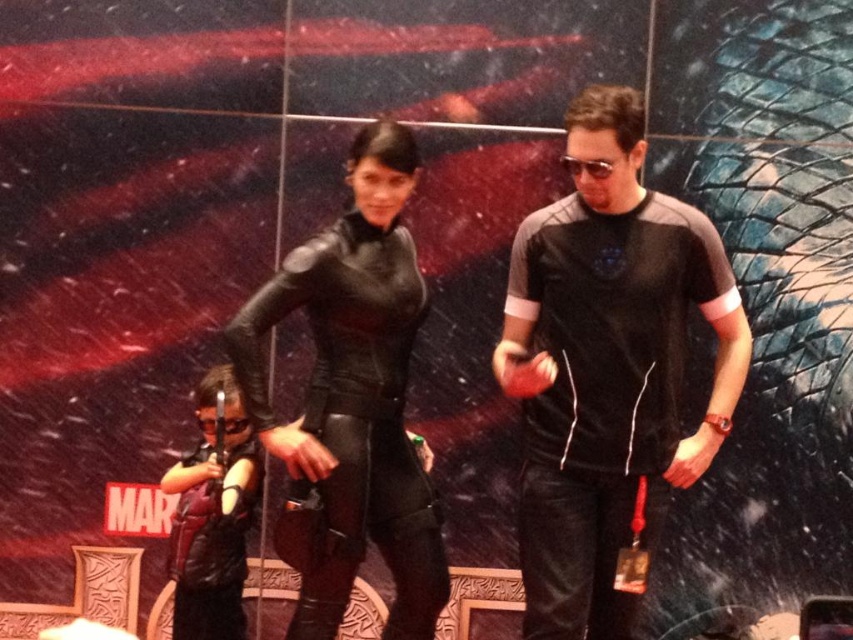
Where is `black fabric shirt at center`? black fabric shirt at center is located at coordinates click(x=607, y=364).

Which is behind, point (544, 577) or point (213, 604)?

The point (213, 604) is more distant.

The image size is (853, 640). In order to click on black fabric shirt at center in this screenshot , I will do `click(607, 364)`.

Is point (595, 470) in front of point (247, 401)?

No, it is behind (247, 401).

Which is behind, point (630, 429) or point (410, 627)?

The point (410, 627) is more distant.

Measure the distance between point (531, 320) and camera.

A distance of 2.66 meters exists between point (531, 320) and camera.

This screenshot has width=853, height=640. Identify the location of black fabric shirt at center. (607, 364).

Consider the image. How far apart are black leather suit at center and black leather wetsuit at center?

They are 26.32 inches apart.

Is black leather suit at center taller than black leather wetsuit at center?

Yes, black leather suit at center is taller than black leather wetsuit at center.

The height and width of the screenshot is (640, 853). Identify the location of black leather suit at center. (354, 396).